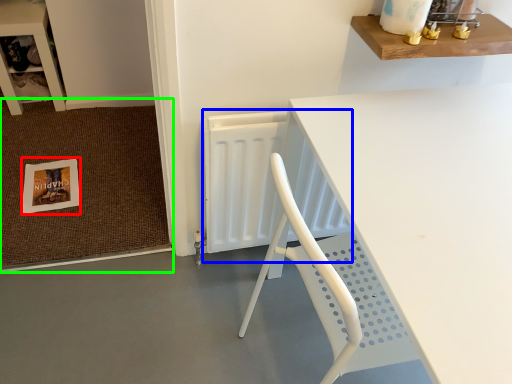
Question: Based on their relative distances, which object is farther from postcard (highlighted by a red box)? Choose from radiator (highlighted by a blue box) and doormat (highlighted by a green box).

Choices:
 (A) radiator
 (B) doormat

Answer: (A)